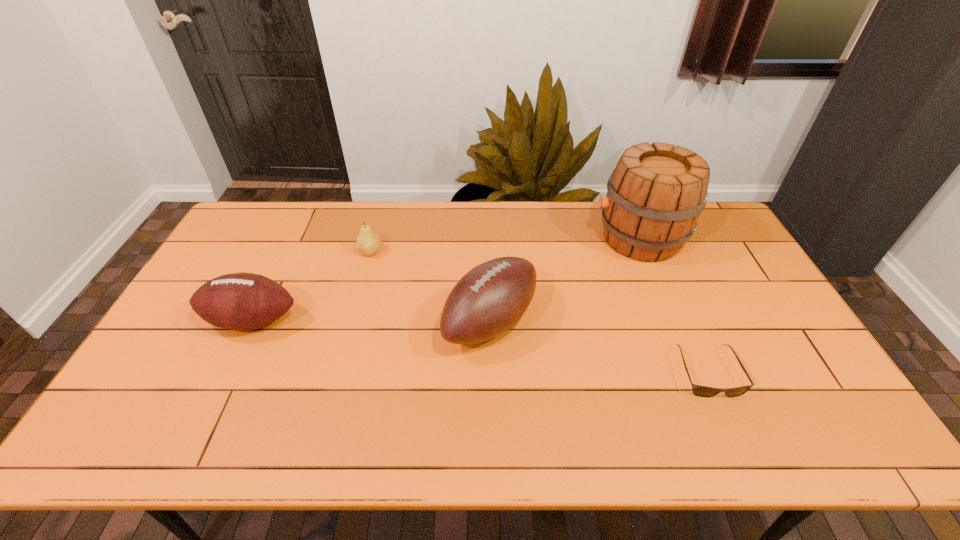
Find the location of `unoccupied area between the sunglasses and the second object from left to right`. unoccupied area between the sunglasses and the second object from left to right is located at coordinates (539, 312).

Where is `vacant space in between the shortest object and the fourth shortest object`? The width and height of the screenshot is (960, 540). vacant space in between the shortest object and the fourth shortest object is located at coordinates (599, 347).

At what (x,y) coordinates should I click in order to perform the action: click on vacant region between the shortest object and the third object from right to left. Please return your answer as a coordinate pair (x, y). Looking at the image, I should click on (599, 347).

Image resolution: width=960 pixels, height=540 pixels. I want to click on unoccupied position between the leftmost object and the pear, so click(311, 286).

Choose which object is the nearest neighbor to the third object from right to left. Please provide its 2D coordinates. Your answer should be formatted as a tuple, i.e. [(x, y)], where the tuple contains the x and y coordinates of a point satisfying the conditions above.

[(655, 195)]

Point out which object is positioned as the nearest to the sunglasses. Please provide its 2D coordinates. Your answer should be formatted as a tuple, i.e. [(x, y)], where the tuple contains the x and y coordinates of a point satisfying the conditions above.

[(655, 195)]